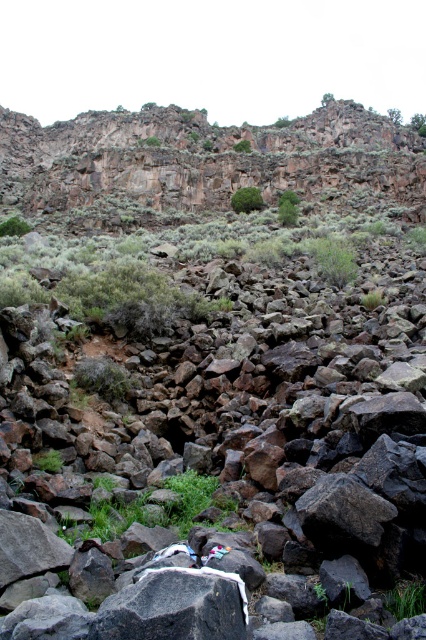
Question: Does gray rock at center appear on the left side of green leafy bush at center?

Choices:
 (A) yes
 (B) no

Answer: (A)

Question: Which of these objects is positioned farthest from the gray rock at center?

Choices:
 (A) green leafy shrub at lower left
 (B) green mossy rock at upper center
 (C) rugged rock cliff at upper center
 (D) green leafy bush at center

Answer: (B)

Question: Does rugged rock cliff at upper center have a larger size compared to green leafy bush at center?

Choices:
 (A) no
 (B) yes

Answer: (B)

Question: Does green leafy shrub at lower left appear on the right side of green mossy rock at upper center?

Choices:
 (A) no
 (B) yes

Answer: (A)

Question: Among these points, which one is farthest from the camera?

Choices:
 (A) (284, 404)
 (B) (17, 221)

Answer: (B)

Question: Which object is positioned closest to the gray rock at center?

Choices:
 (A) green leafy bush at center
 (B) green leafy shrub at lower left

Answer: (A)